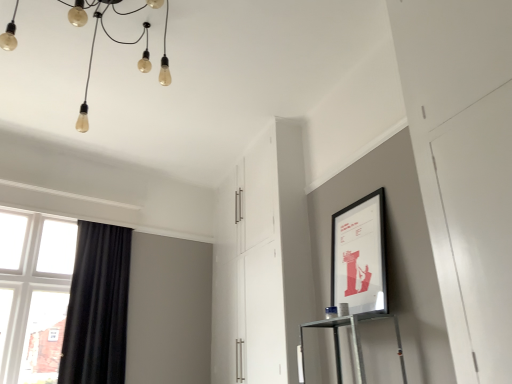
Question: Does translucent glass lightbulbs at upper left have a lesser height compared to matte black picture frame at upper right?

Choices:
 (A) yes
 (B) no

Answer: (A)

Question: Is translucent glass lightbulbs at upper left further to camera compared to matte black picture frame at upper right?

Choices:
 (A) yes
 (B) no

Answer: (B)

Question: Is translucent glass lightbulbs at upper left looking in the opposite direction of matte black picture frame at upper right?

Choices:
 (A) no
 (B) yes

Answer: (A)

Question: Is translucent glass lightbulbs at upper left at the right side of matte black picture frame at upper right?

Choices:
 (A) yes
 (B) no

Answer: (B)

Question: Is translucent glass lightbulbs at upper left next to matte black picture frame at upper right and touching it?

Choices:
 (A) yes
 (B) no

Answer: (B)

Question: Is matte black picture frame at upper right completely or partially inside translucent glass lightbulbs at upper left?

Choices:
 (A) no
 (B) yes

Answer: (A)

Question: Considering the relative sizes of white glossy cabinet at center and clear glass window at left in the image provided, is white glossy cabinet at center smaller than clear glass window at left?

Choices:
 (A) no
 (B) yes

Answer: (A)

Question: Is white glossy cabinet at center next to clear glass window at left and touching it?

Choices:
 (A) yes
 (B) no

Answer: (B)

Question: Considering the relative sizes of white glossy cabinet at center and clear glass window at left in the image provided, is white glossy cabinet at center thinner than clear glass window at left?

Choices:
 (A) yes
 (B) no

Answer: (B)

Question: Is white glossy cabinet at center in front of clear glass window at left?

Choices:
 (A) yes
 (B) no

Answer: (A)

Question: Does white glossy cabinet at center have a lesser height compared to clear glass window at left?

Choices:
 (A) no
 (B) yes

Answer: (A)

Question: Is white glossy cabinet at center facing towards clear glass window at left?

Choices:
 (A) no
 (B) yes

Answer: (B)

Question: Considering the relative sizes of matte black picture frame at upper right and clear glass window at left in the image provided, is matte black picture frame at upper right wider than clear glass window at left?

Choices:
 (A) no
 (B) yes

Answer: (B)